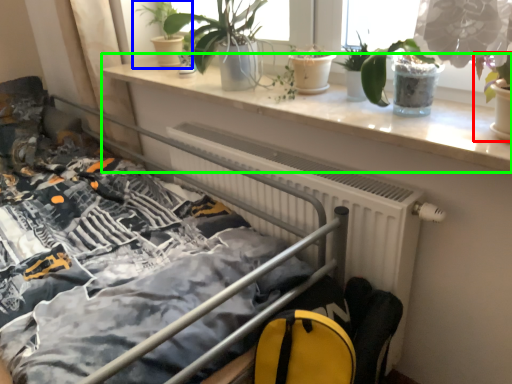
Question: Which is nearer to the houseplant (highlighted by a red box)? houseplant (highlighted by a blue box) or window sill (highlighted by a green box).

Choices:
 (A) houseplant
 (B) window sill

Answer: (B)